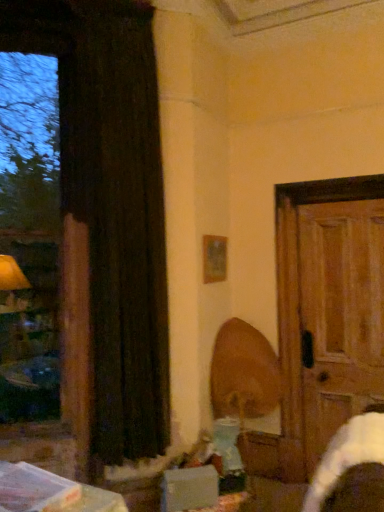
Question: Choose the correct answer: Is wooden swivel chair at center inside black velvet curtain at left or outside it?

Choices:
 (A) outside
 (B) inside

Answer: (A)

Question: From a real-world perspective, is wooden swivel chair at center physically located above or below black velvet curtain at left?

Choices:
 (A) above
 (B) below

Answer: (B)

Question: Estimate the real-world distances between objects in this image. Which object is farther from the white cardboard box at lower center?

Choices:
 (A) wooden picture frame at upper center
 (B) black velvet curtain at left
 (C) wooden swivel chair at center
 (D) wooden door at right

Answer: (A)

Question: Considering the real-world distances, which object is closest to the wooden picture frame at upper center?

Choices:
 (A) black velvet curtain at left
 (B) white cardboard box at lower center
 (C) wooden door at right
 (D) wooden swivel chair at center

Answer: (D)